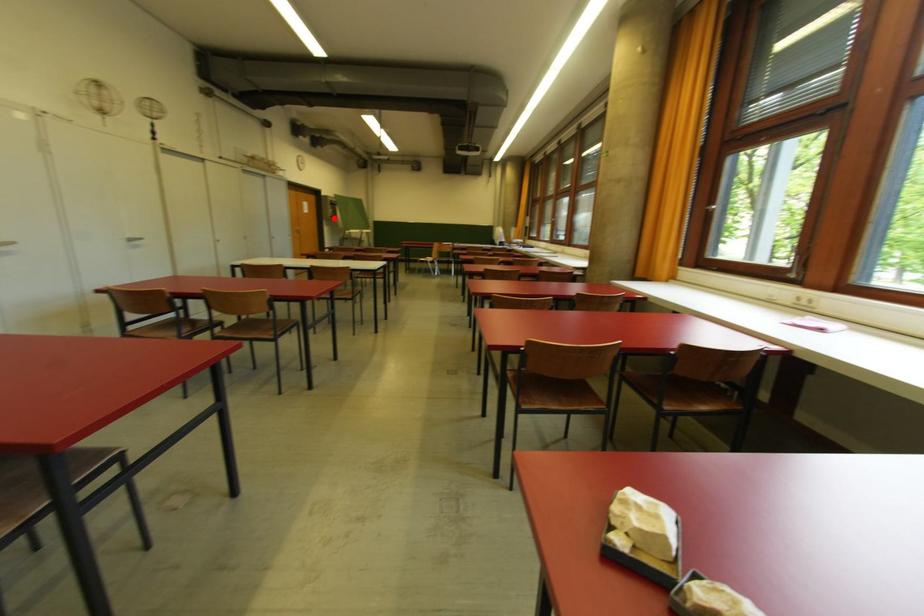
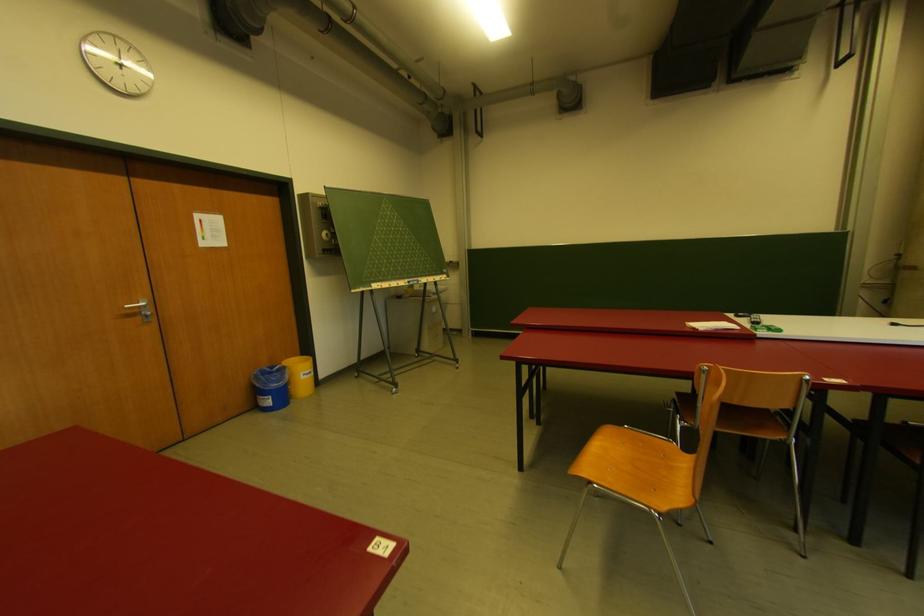
Locate, in the second image, the point that corresponds to the highlighted location in the first image.

(326, 252)